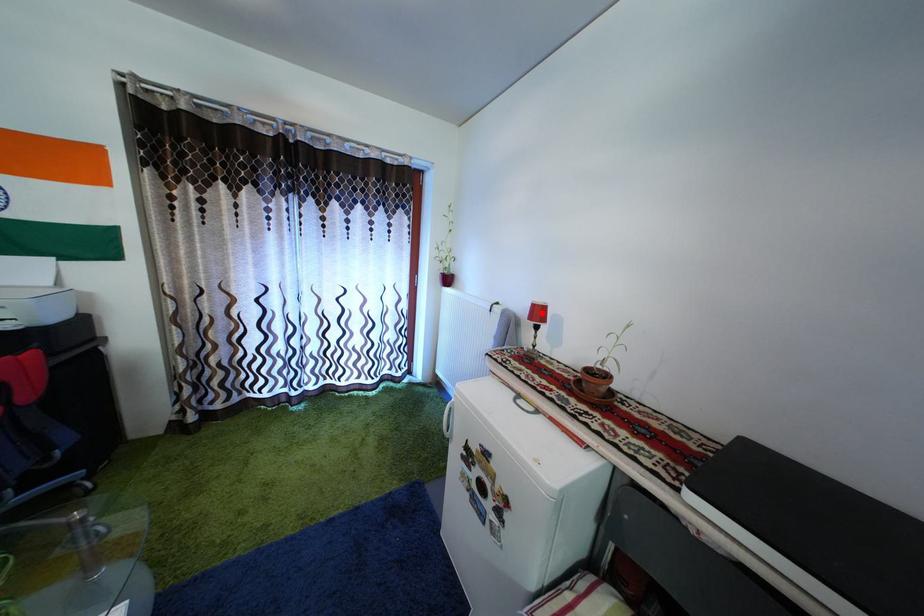
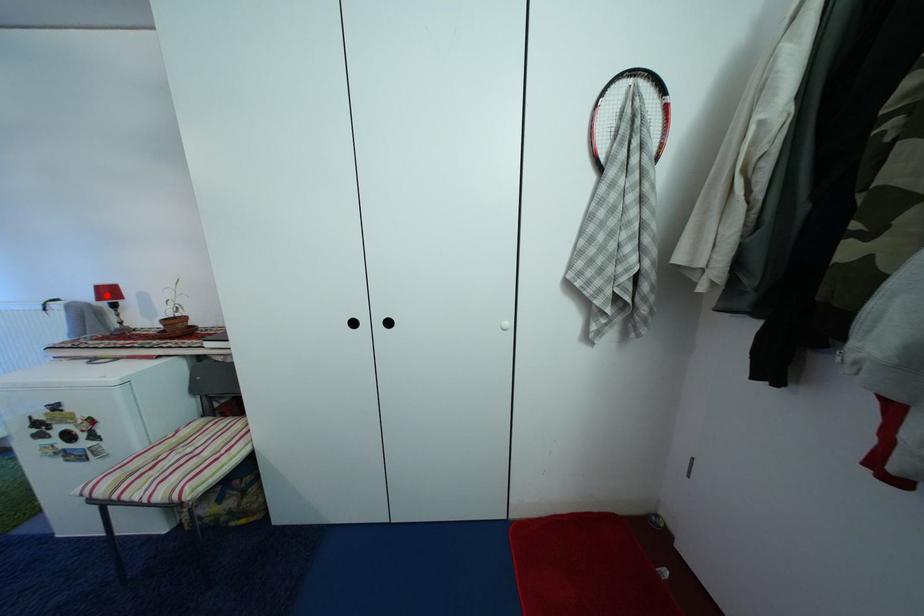
I am providing you with two images of the same scene from different viewpoints. A red point is marked on the first image and another point is marked on the second image. Are the points marked in image1 and image2 representing the same 3D position?

Yes